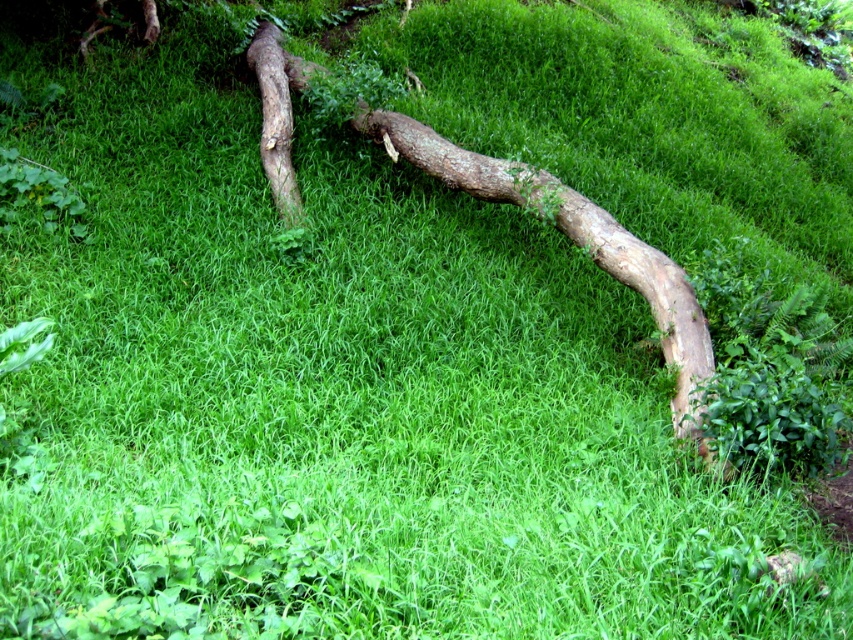
You are a hiker who wants to cross over the brown rough wood at center and the brown rough tree trunk at upper left. Which one is higher above the ground so you can step on it first?

The brown rough wood at center is taller than the brown rough tree trunk at upper left, so you can step on the brown rough wood at center first.

You are a hiker navigating through the forest and see the brown rough wood at center and the brown rough tree trunk at upper left. Which object is closer to the ground?

The brown rough wood at center is closer to the ground because it is below the brown rough tree trunk at upper left.